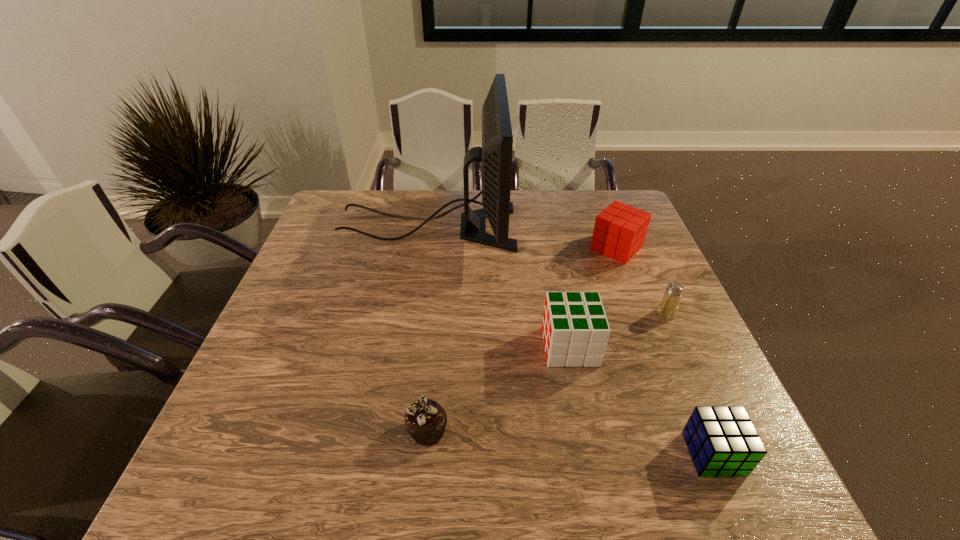
Identify which cube is the second closest to the farthest cube. Please provide its 2D coordinates. Your answer should be formatted as a tuple, i.e. [(x, y)], where the tuple contains the x and y coordinates of a point satisfying the conditions above.

[(722, 441)]

At what (x,y) coordinates should I click in order to perform the action: click on vacant space that satisfies the following two spatial constraints: 1. on the screen side of the computer monitor; 2. on the back side of the shortest cube. Please return your answer as a coordinate pair (x, y). The image size is (960, 540). Looking at the image, I should click on (393, 454).

You are a GUI agent. You are given a task and a screenshot of the screen. Output one action in this format:
    pyautogui.click(x=<x>, y=<y>)
    Task: Click on the vacant region that satisfies the following two spatial constraints: 1. on the red face of the shortest cube; 2. on the left side of the leftmost cube
    This screenshot has width=960, height=540.
    Given the screenshot: What is the action you would take?
    pyautogui.click(x=591, y=454)

The height and width of the screenshot is (540, 960). I want to click on vacant area in the image that satisfies the following two spatial constraints: 1. on the screen side of the third farthest object; 2. on the right side of the tallest object, so click(414, 313).

Identify the location of free location that satisfies the following two spatial constraints: 1. on the screen side of the computer monitor; 2. on the left side of the cupcake. (396, 430).

Where is `blank area in the image that satisfies the following two spatial constraints: 1. on the front side of the farthest cube; 2. on the left side of the shortest cube`? blank area in the image that satisfies the following two spatial constraints: 1. on the front side of the farthest cube; 2. on the left side of the shortest cube is located at coordinates (696, 454).

Identify the location of free space in the image that satisfies the following two spatial constraints: 1. on the screen side of the farthest cube; 2. on the right side of the computer monitor. The width and height of the screenshot is (960, 540). (424, 248).

At what (x,y) coordinates should I click in order to perform the action: click on vacant area in the image that satisfies the following two spatial constraints: 1. on the screen side of the saltshaker; 2. on the left side of the computer monitor. Please return your answer as a coordinate pair (x, y). Looking at the image, I should click on (414, 313).